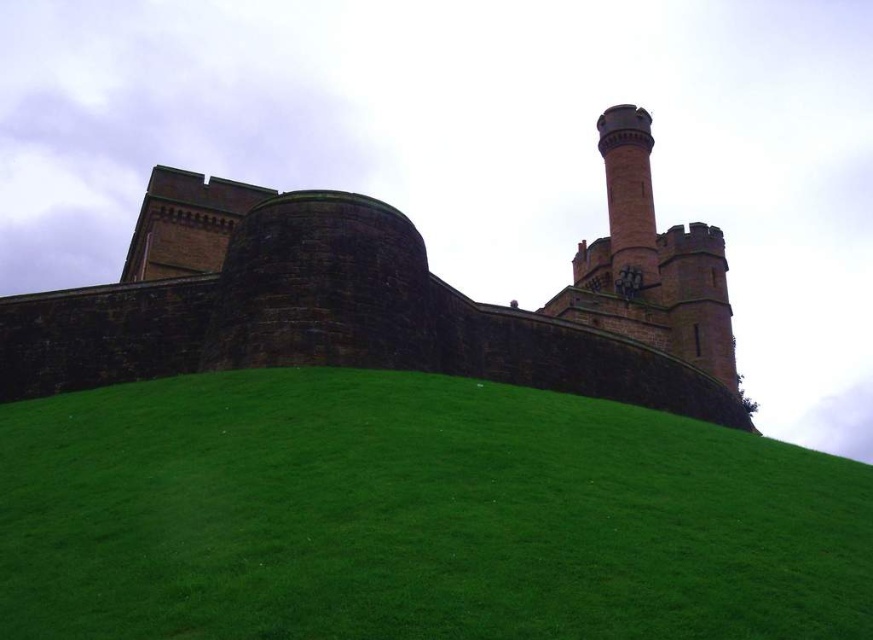
Question: Is green grassy hill at lower center bigger than brown stone castle at upper center?

Choices:
 (A) no
 (B) yes

Answer: (A)

Question: Among these objects, which one is nearest to the camera?

Choices:
 (A) red brick chimney at upper right
 (B) brown stone castle at upper center

Answer: (B)

Question: Which is nearer to the green grassy hill at lower center?

Choices:
 (A) red brick chimney at upper right
 (B) brown stone castle at upper center

Answer: (B)

Question: From the image, what is the correct spatial relationship of green grassy hill at lower center in relation to red brick chimney at upper right?

Choices:
 (A) above
 (B) below

Answer: (B)

Question: Considering the relative positions of brown stone castle at upper center and red brick chimney at upper right in the image provided, where is brown stone castle at upper center located with respect to red brick chimney at upper right?

Choices:
 (A) left
 (B) right

Answer: (A)

Question: Which of the following is the closest to the observer?

Choices:
 (A) (448, 516)
 (B) (609, 353)

Answer: (A)